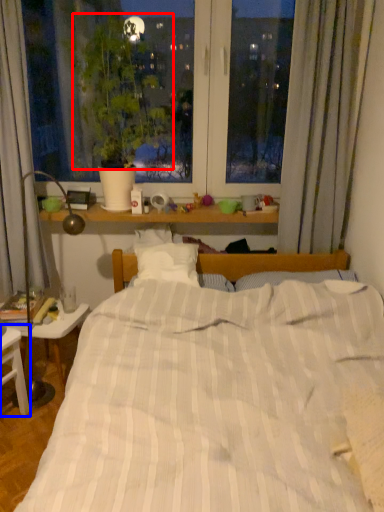
Question: Among these objects, which one is farthest to the camera, plant (highlighted by a red box) or nightstand (highlighted by a blue box)?

Choices:
 (A) plant
 (B) nightstand

Answer: (A)